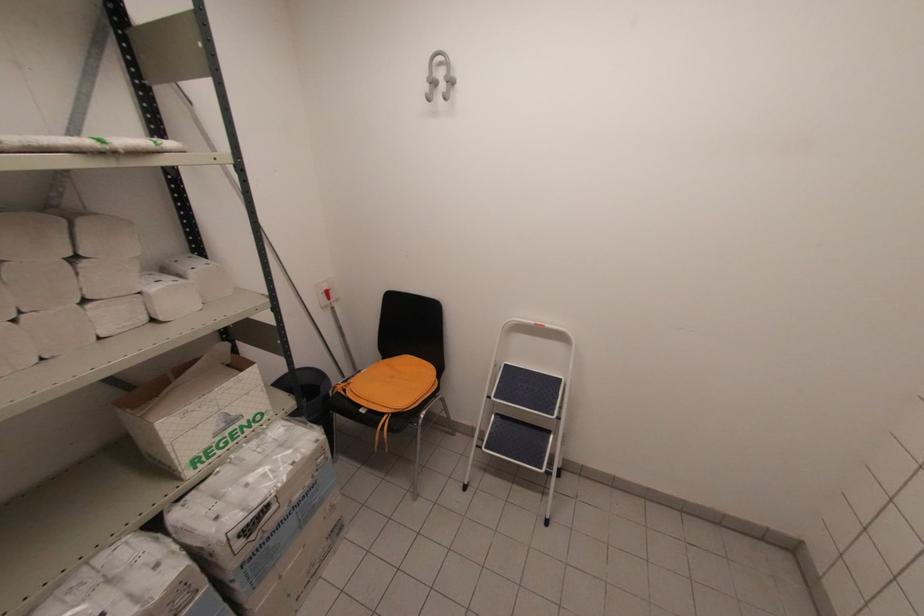
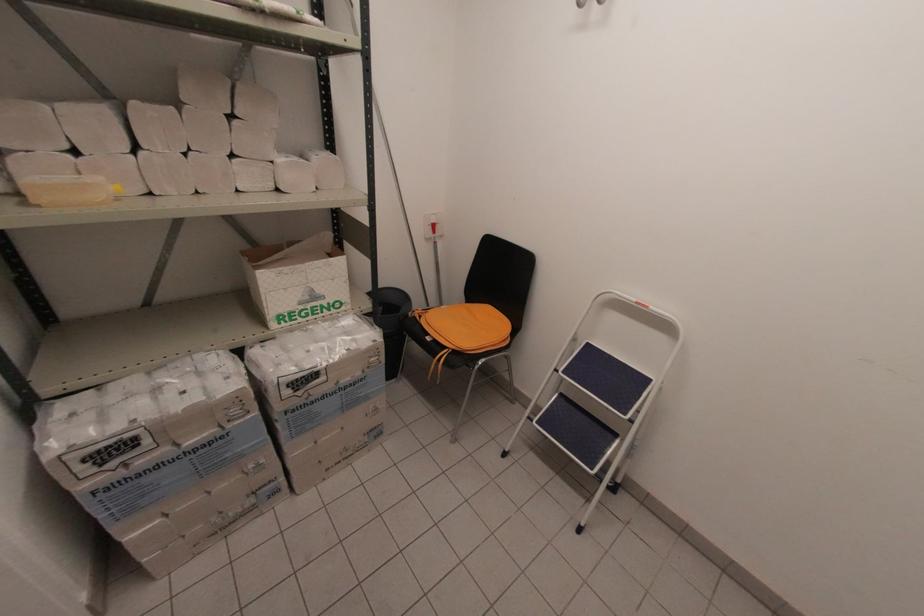
The point at [271,539] is marked in the first image. Where is the corresponding point in the second image?

(312, 403)